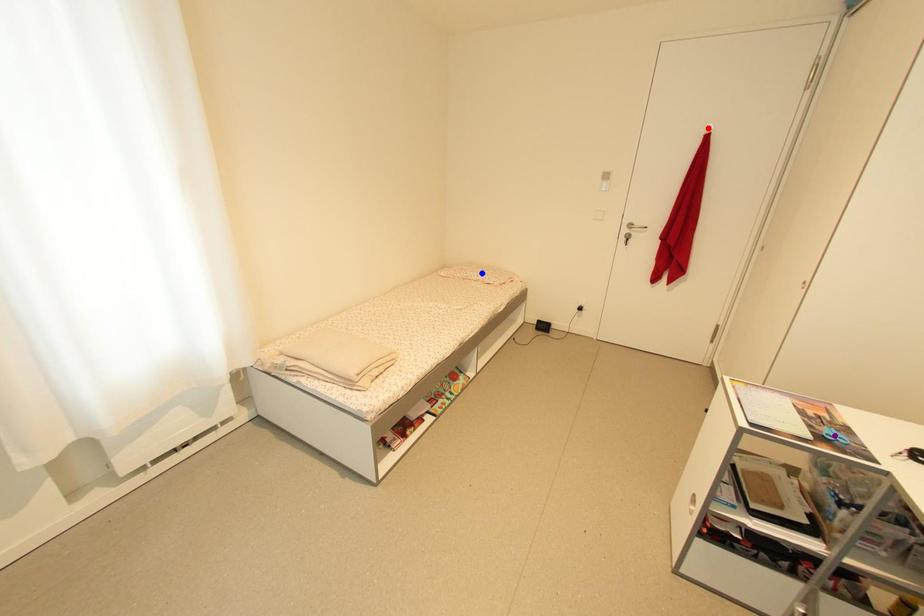
Order these from nearest to farthest:
- purple point
- red point
- blue point

1. purple point
2. red point
3. blue point